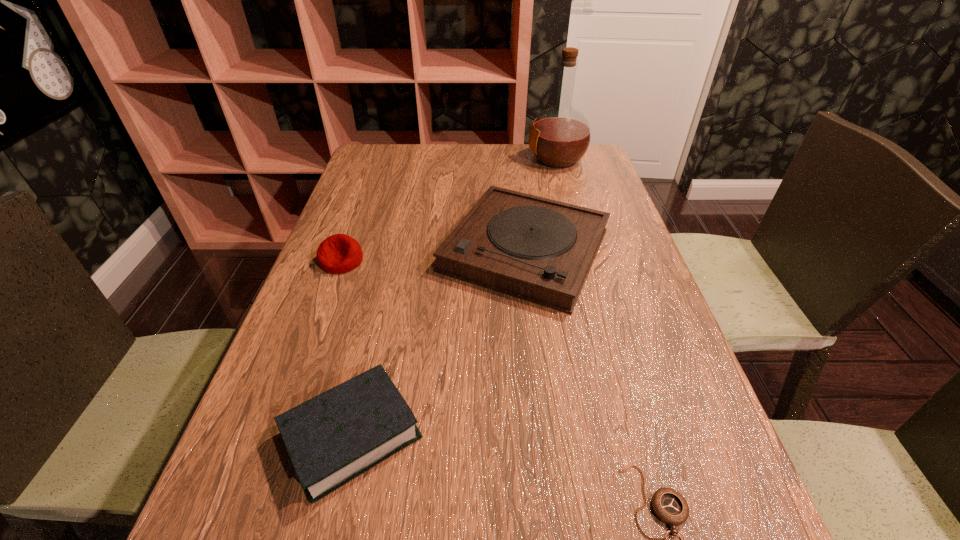
Locate an element on the screen. The width and height of the screenshot is (960, 540). vacant space at the far right corner of the desktop is located at coordinates (564, 170).

The height and width of the screenshot is (540, 960). I want to click on vacant area between the Bible and the phonograph record, so click(x=439, y=342).

Locate an element on the screen. The width and height of the screenshot is (960, 540). vacant area that lies between the second shortest object and the phonograph record is located at coordinates (439, 342).

At what (x,y) coordinates should I click in order to perform the action: click on blank region between the farthest object and the Bible. Please return your answer as a coordinate pair (x, y). Looking at the image, I should click on pos(454,297).

Identify the location of blank region between the fourth tallest object and the phonograph record. This screenshot has width=960, height=540. (439, 342).

Locate an element on the screen. This screenshot has height=540, width=960. vacant space that is in between the Bible and the beanbag is located at coordinates (347, 347).

Identify the location of empty location between the tallest object and the Bible. The width and height of the screenshot is (960, 540). (454, 297).

In order to click on free space between the beanbag and the liquor in this screenshot , I will do `click(449, 210)`.

This screenshot has width=960, height=540. I want to click on vacant space that's between the liquor and the beanbag, so click(x=449, y=210).

Locate an element on the screen. free space between the Bible and the beanbag is located at coordinates (347, 347).